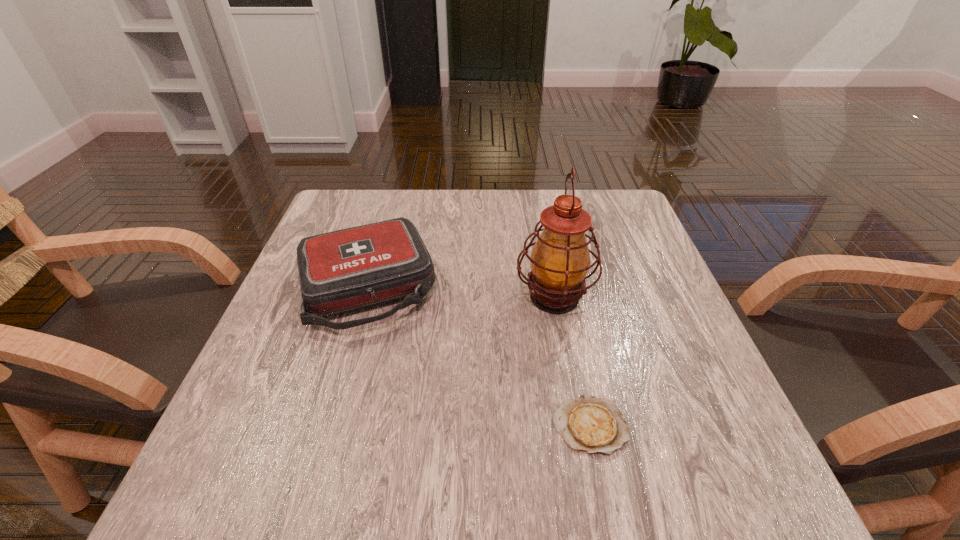
Identify the location of vacant area between the nearest object and the second shortest object. The height and width of the screenshot is (540, 960). (478, 356).

Find the location of a particular element. The height and width of the screenshot is (540, 960). free spot between the oil lamp and the leftmost object is located at coordinates (461, 292).

Image resolution: width=960 pixels, height=540 pixels. I want to click on free spot between the leftmost object and the tallest object, so click(461, 292).

Where is `free point between the quiche and the second shortest object`? This screenshot has width=960, height=540. free point between the quiche and the second shortest object is located at coordinates (478, 356).

Find the location of a particular element. free space between the tallest object and the first-aid kit is located at coordinates 461,292.

Where is `free space between the tallest object and the shortest object`? free space between the tallest object and the shortest object is located at coordinates (572, 361).

In order to click on object that stands as the closest to the tallest object in this screenshot , I will do `click(589, 424)`.

Identify the location of the closest object to the shortest object. This screenshot has width=960, height=540. (560, 259).

Locate an element on the screen. This screenshot has height=540, width=960. blank space that satisfies the following two spatial constraints: 1. on the front side of the leftmost object; 2. on the right side of the oil lamp is located at coordinates (364, 297).

You are a GUI agent. You are given a task and a screenshot of the screen. Output one action in this format:
    pyautogui.click(x=<x>, y=<y>)
    Task: Click on the free location that satisfies the following two spatial constraints: 1. on the front side of the tallest object; 2. on the left side of the first-aid kit
    
    Given the screenshot: What is the action you would take?
    tap(364, 297)